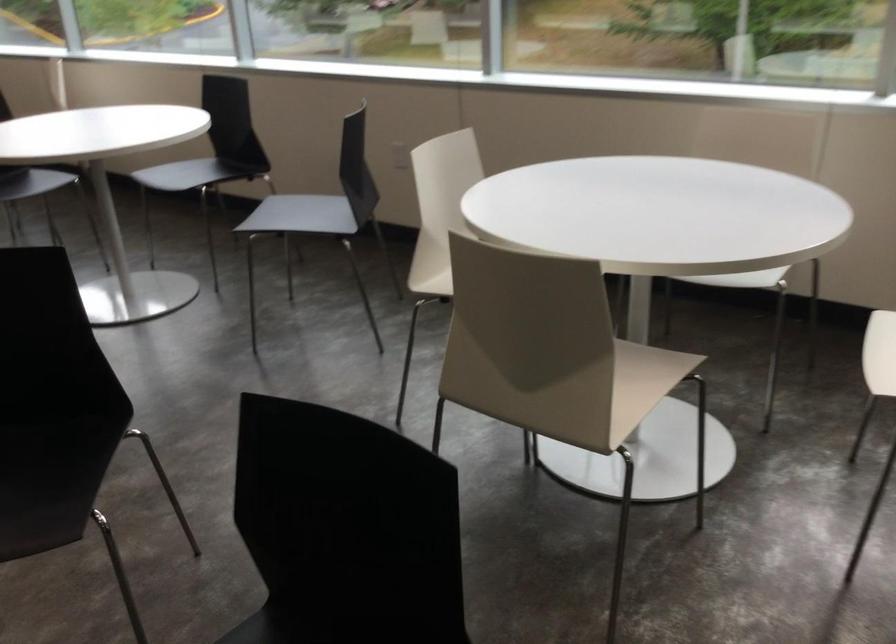
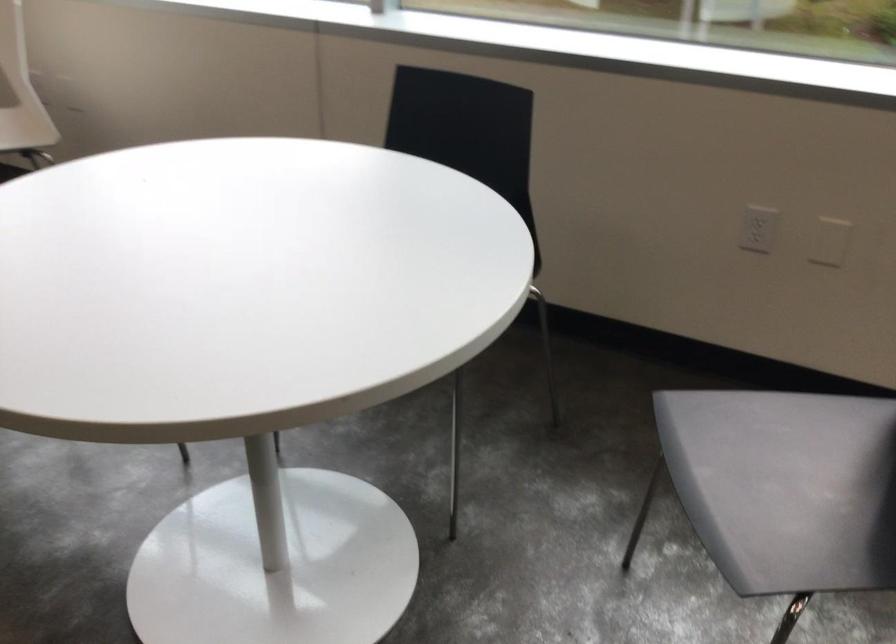
What movement of the cameraman would produce the second image?

The cameraman walked toward left, forward.